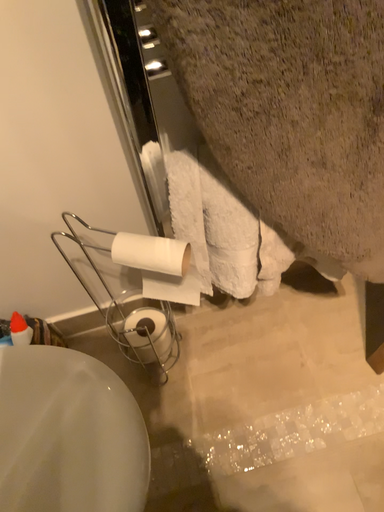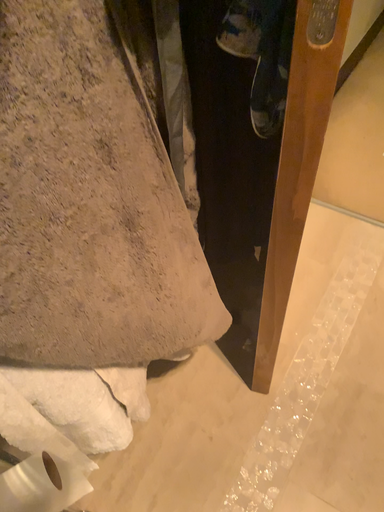
Question: How did the camera likely rotate when shooting the video?

Choices:
 (A) rotated downward
 (B) rotated upward

Answer: (B)